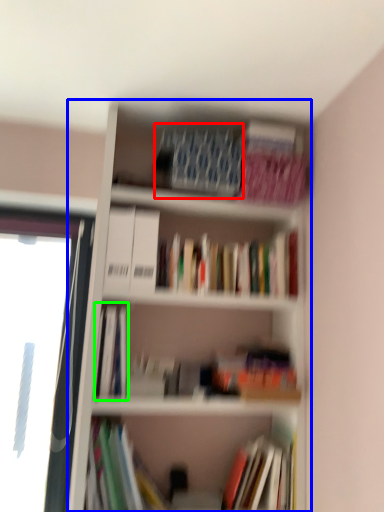
Question: Based on their relative distances, which object is nearer to paperback book (highlighted by a red box)? Choose from bookcase (highlighted by a blue box) and book (highlighted by a green box).

Choices:
 (A) bookcase
 (B) book

Answer: (A)